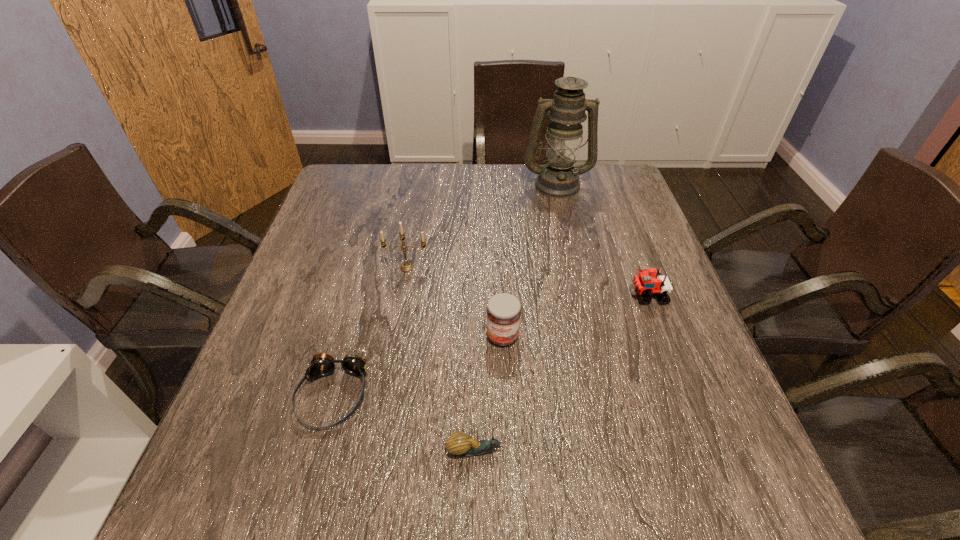
Locate an element on the screen. This screenshot has width=960, height=540. free space that is in between the fifth farthest object and the farthest object is located at coordinates (445, 289).

Where is `free spot between the nearest object and the rightmost object`? The image size is (960, 540). free spot between the nearest object and the rightmost object is located at coordinates (562, 373).

The height and width of the screenshot is (540, 960). Identify the location of vacant area between the second nearest object and the candle. (370, 331).

The width and height of the screenshot is (960, 540). I want to click on vacant area that lies between the third farthest object and the fifth shortest object, so click(527, 281).

I want to click on empty location between the goggles and the third tallest object, so click(418, 366).

Find the location of `empty location between the escargot and the third farthest object`. empty location between the escargot and the third farthest object is located at coordinates (562, 373).

Identify the location of vacant area between the nearest object and the third nearest object. (489, 393).

Find the location of `unoccupied area between the second tallest object and the second object from right to left`. unoccupied area between the second tallest object and the second object from right to left is located at coordinates (482, 226).

The image size is (960, 540). I want to click on object that ranks as the closest to the third farthest object, so click(x=503, y=314).

Identify which object is the fourth closest to the fifth farthest object. Please provide its 2D coordinates. Your answer should be formatted as a tuple, i.e. [(x, y)], where the tuple contains the x and y coordinates of a point satisfying the conditions above.

[(644, 284)]